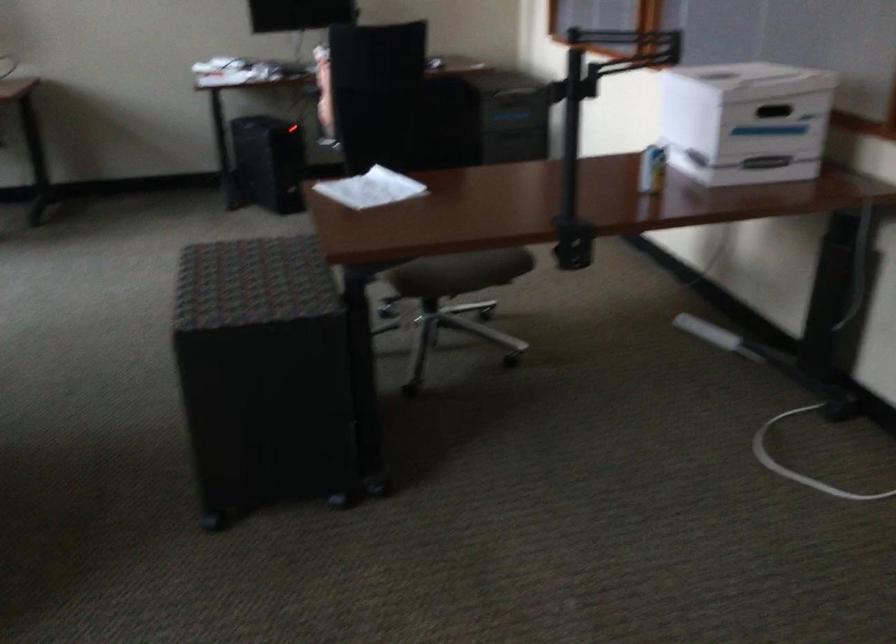
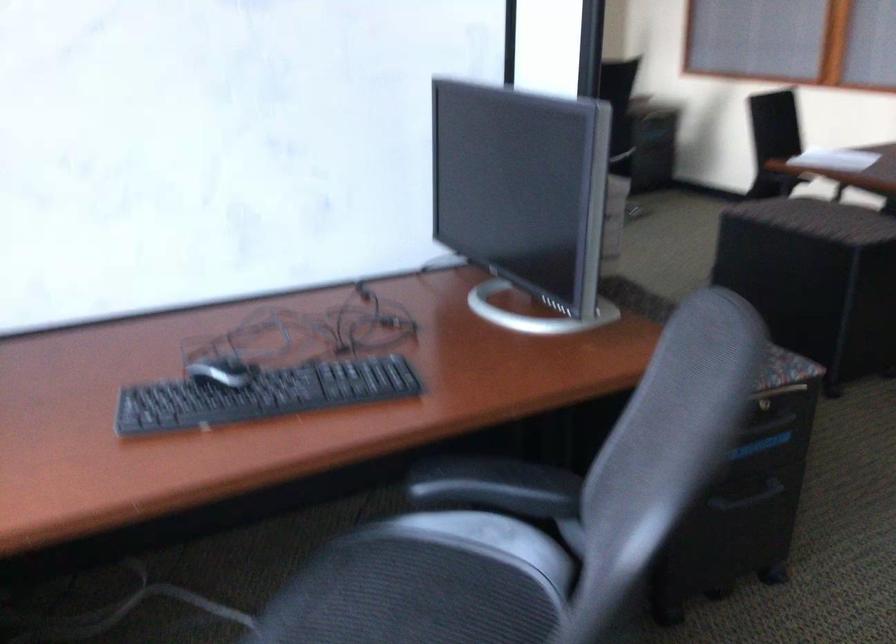
Question: What movement of the cameraman would produce the second image?

Choices:
 (A) Left
 (B) Right
 (C) Forward
 (D) Backward

Answer: (A)